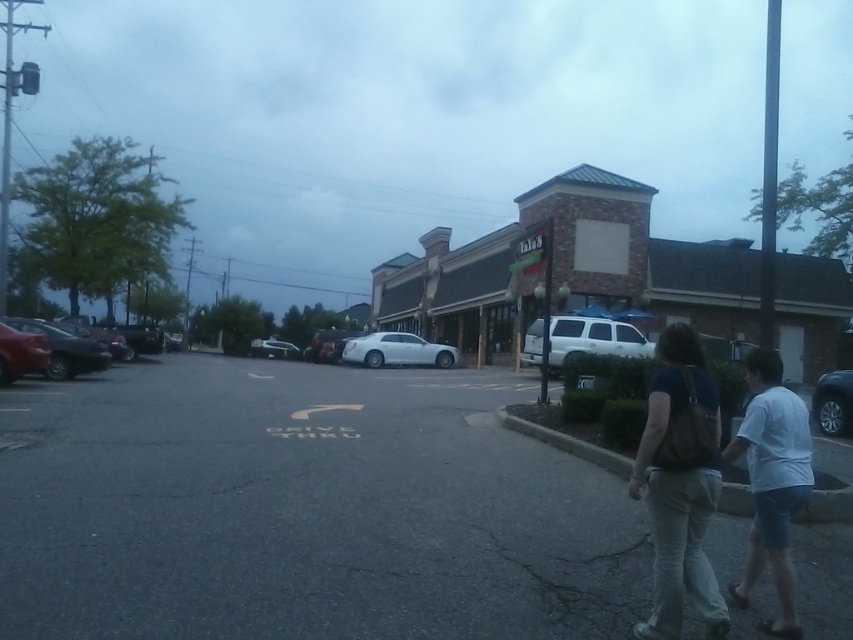
Can you confirm if white matte suv at center is positioned above shiny silver sedan at left?

Actually, white matte suv at center is below shiny silver sedan at left.

Who is positioned more to the left, white matte suv at center or shiny silver sedan at left?

From the viewer's perspective, shiny silver sedan at left appears more on the left side.

Which is in front, point (527, 344) or point (102, 340)?

Point (527, 344) is in front.

You are a GUI agent. You are given a task and a screenshot of the screen. Output one action in this format:
    pyautogui.click(x=<x>, y=<y>)
    Task: Click on the white matte suv at center
    The height and width of the screenshot is (640, 853).
    Given the screenshot: What is the action you would take?
    pyautogui.click(x=593, y=339)

Can you confirm if dark brown leather purse at lower right is taller than shiny red sedan at left?

Correct, dark brown leather purse at lower right is much taller as shiny red sedan at left.

Which is below, dark brown leather purse at lower right or shiny red sedan at left?

Positioned lower is dark brown leather purse at lower right.

Identify the location of dark brown leather purse at lower right. point(679,492).

Locate an element on the screen. dark brown leather purse at lower right is located at coordinates (679, 492).

Is white cotton shirt at lower right bigger than matte black car at left?

Actually, white cotton shirt at lower right might be smaller than matte black car at left.

In the scene shown: Is white cotton shirt at lower right further to the viewer compared to matte black car at left?

No, white cotton shirt at lower right is in front of matte black car at left.

Between point (785, 540) and point (61, 355), which one is positioned in front?

Point (785, 540) is in front.

I want to click on white cotton shirt at lower right, so click(x=772, y=483).